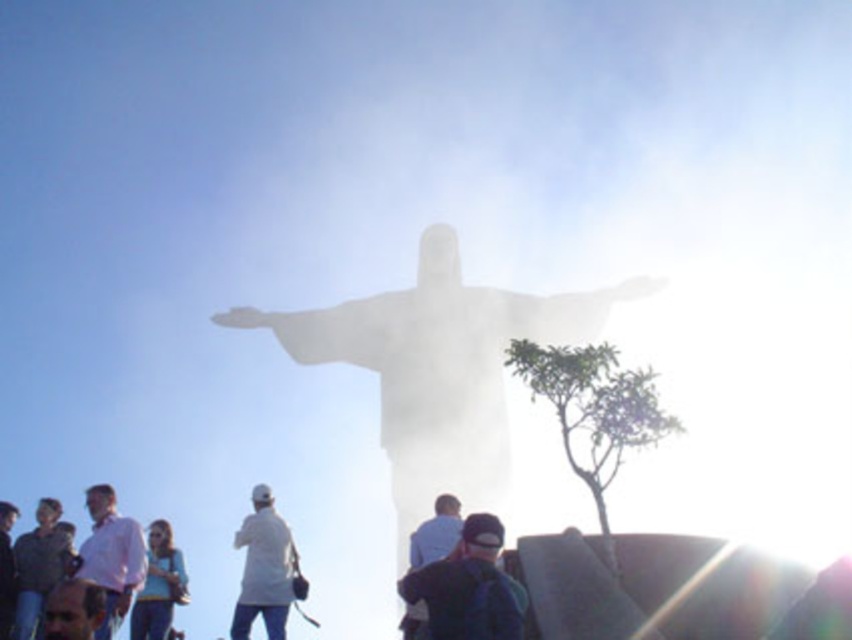
Question: Which is farther from the white marble statue at center?

Choices:
 (A) pink matte shirt at lower left
 (B) white matte jacket at center

Answer: (A)

Question: Can you confirm if white marble statue at center is wider than light blue shirt at center?

Choices:
 (A) yes
 (B) no

Answer: (A)

Question: Which point is farther to the camera?

Choices:
 (A) light blue shirt at center
 (B) pink matte shirt at lower left

Answer: (B)

Question: Is white matte jacket at center bigger than light blue shirt at center?

Choices:
 (A) yes
 (B) no

Answer: (B)

Question: Considering the real-world distances, which object is closest to the dark blue fabric cap at lower center?

Choices:
 (A) pink matte shirt at lower left
 (B) light blue shirt at center

Answer: (B)

Question: Is white matte jacket at center thinner than light blue shirt at center?

Choices:
 (A) no
 (B) yes

Answer: (A)